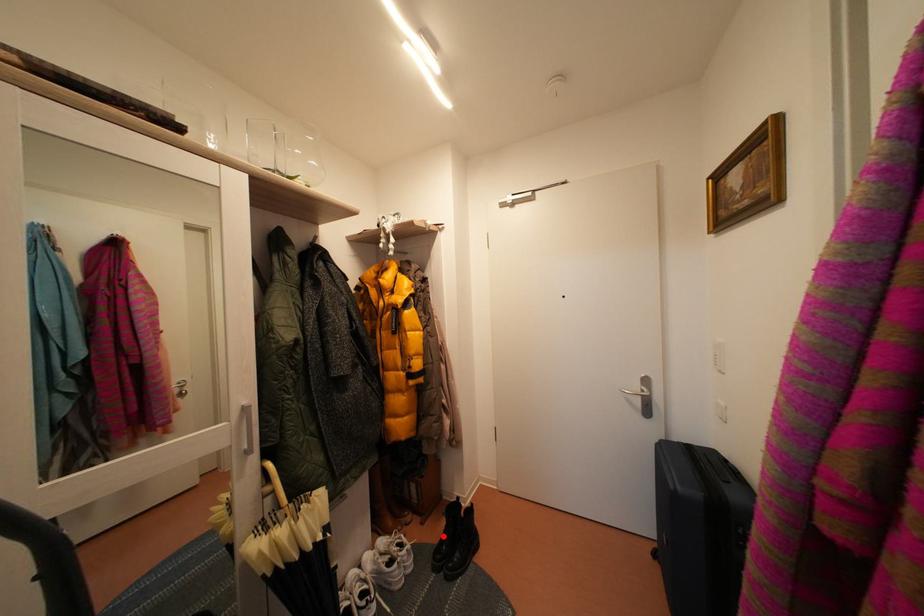
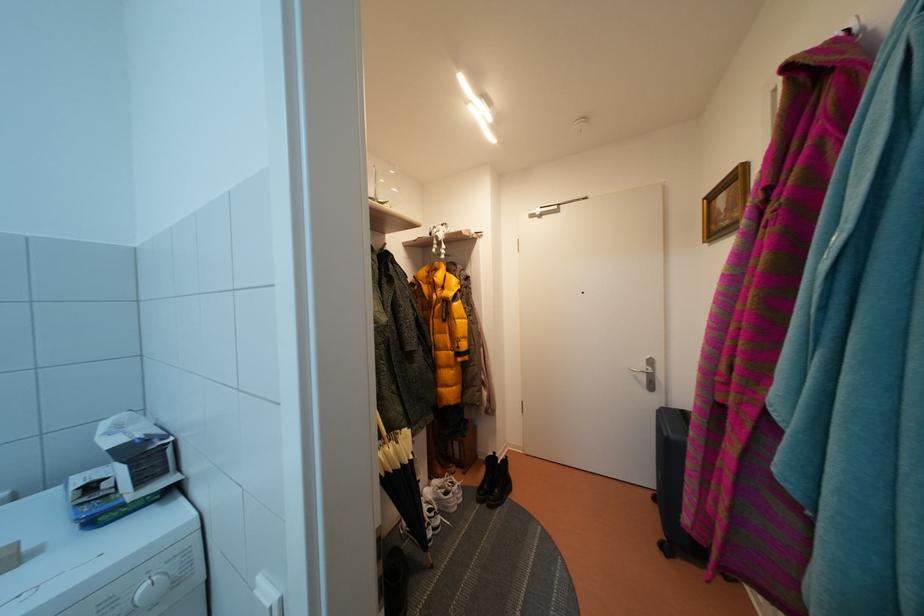
Question: I am providing you with two images of the same scene from different viewpoints. In image1, a red point is highlighted. Considering the same 3D point in image2, which of the following is correct?

Choices:
 (A) It is closer
 (B) It is farther

Answer: (B)